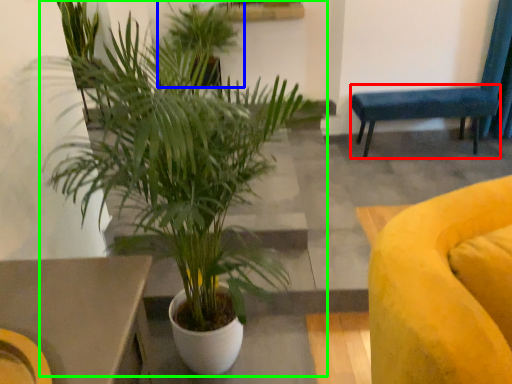
Question: Which object is positioned farthest from armchair (highlighted by a red box)? Select from houseplant (highlighted by a blue box) and houseplant (highlighted by a green box).

Choices:
 (A) houseplant
 (B) houseplant

Answer: (B)